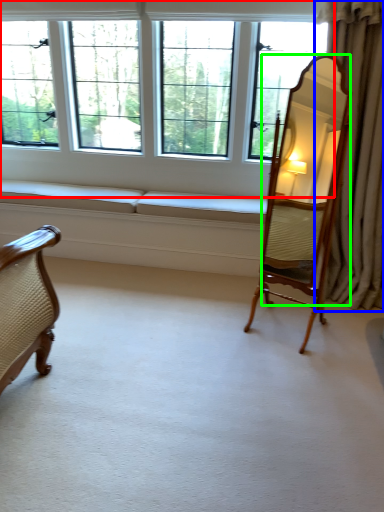
Question: Based on their relative distances, which object is farther from window (highlighted by a red box)? Choose from curtain (highlighted by a blue box) and mirror (highlighted by a green box).

Choices:
 (A) curtain
 (B) mirror

Answer: (A)